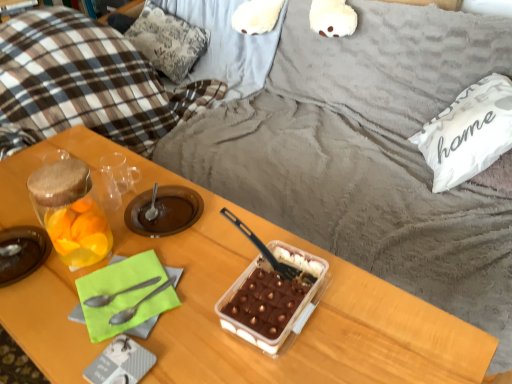
Locate an element on the screen. The height and width of the screenshot is (384, 512). free space above translucent plastic tray at center, the first snack when ordered from right to left (from a real-world perspective) is located at coordinates (270, 290).